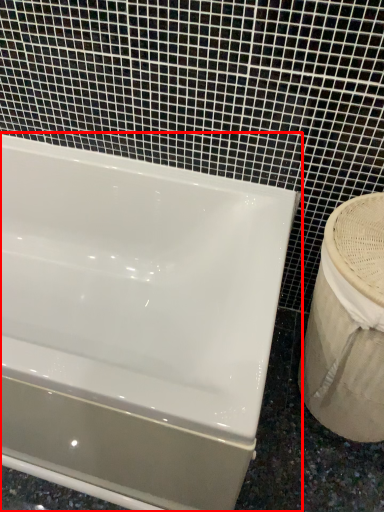
Question: From the image's perspective, what is the correct spatial positioning of bathtub (annotated by the red box) in reference to sink?

Choices:
 (A) below
 (B) above

Answer: (B)